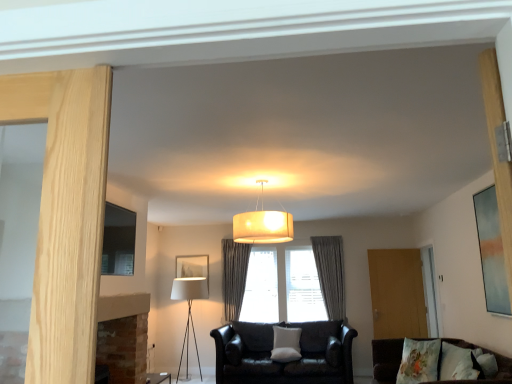
Question: Based on their positions, is wooden screen door at right located to the left or right of gray textured curtain at center, the first curtain from the right?

Choices:
 (A) right
 (B) left

Answer: (A)

Question: Looking at their shapes, would you say wooden screen door at right is wider or thinner than gray textured curtain at center, acting as the 2th curtain starting from the left?

Choices:
 (A) wide
 (B) thin

Answer: (B)

Question: Considering the real-world distances, which object is farthest from the white fabric picture frame at center, the 2th picture frame positioned from the left?

Choices:
 (A) blue textured canvas at right, which is the 1th picture frame from front to back
 (B) matte white fabric at left
 (C) velvet brown couch at lower right, marked as the second studio couch in a back-to-front arrangement
 (D) white fabric pillow at center, the first pillow positioned from the left
 (E) matte black picture frame at left, arranged as the 2th picture frame when viewed from the back

Answer: (A)

Question: Estimate the real-world distances between objects in this image. Which object is farther from the blue textured canvas at right, marked as the 1th picture frame in a right-to-left arrangement?

Choices:
 (A) matte white lampshade at center
 (B) gray fabric curtain at center, marked as the first curtain in a left-to-right arrangement
 (C) white fabric picture frame at center, which is counted as the second picture frame, starting from the right
 (D) fluffy white pillow at lower right, arranged as the 2th pillow when viewed from the right
 (E) matte black table at lower left

Answer: (E)